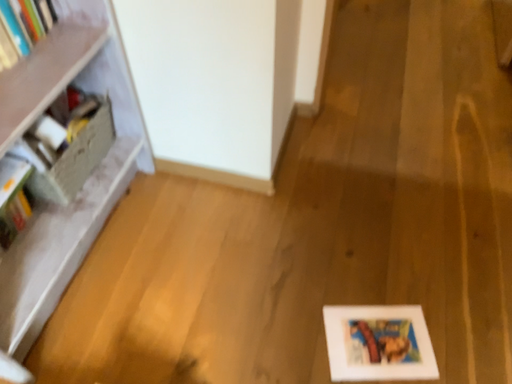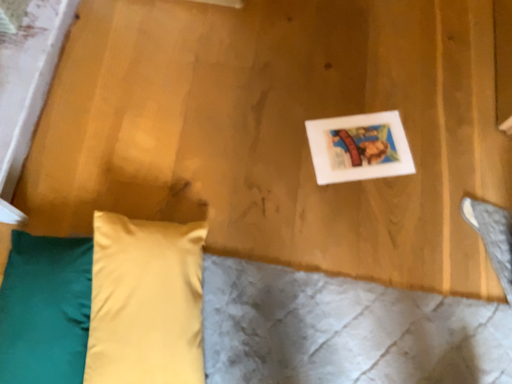
Question: Which way did the camera rotate in the video?

Choices:
 (A) rotated upward
 (B) rotated downward

Answer: (B)